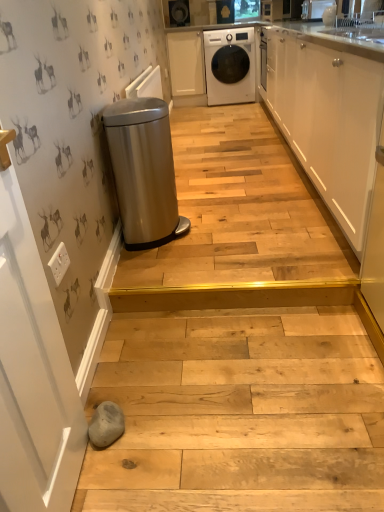
Describe the element at coordinates (230, 66) in the screenshot. I see `white glossy washing machine at upper center` at that location.

This screenshot has height=512, width=384. What do you see at coordinates (186, 63) in the screenshot?
I see `white matte cabinet at center, which appears as the 2th cabinetry when viewed from the right` at bounding box center [186, 63].

Locate an element on the screen. white glossy cabinet at upper right, arranged as the second cabinetry when viewed from the top is located at coordinates (326, 118).

Does stainless steel trash can at left appear on the right side of white glossy washing machine at upper center?

No, stainless steel trash can at left is not to the right of white glossy washing machine at upper center.

Who is taller, stainless steel trash can at left or white glossy washing machine at upper center?

Standing taller between the two is white glossy washing machine at upper center.

Considering the sizes of stainless steel trash can at left and white glossy washing machine at upper center in the image, is stainless steel trash can at left wider or thinner than white glossy washing machine at upper center?

Clearly, stainless steel trash can at left has less width compared to white glossy washing machine at upper center.

From a real-world perspective, is stainless steel trash can at left under white glossy washing machine at upper center?

Correct, in the physical world, stainless steel trash can at left is lower than white glossy washing machine at upper center.

Between white matte cabinet at center, which appears as the 2th cabinetry when viewed from the right, and white glossy cabinet at upper right, which is the first cabinetry from right to left, which one has more height?

white matte cabinet at center, which appears as the 2th cabinetry when viewed from the right, is taller.

Which of these two, white matte cabinet at center, which appears as the 2th cabinetry when viewed from the right, or white glossy cabinet at upper right, which is the 2th cabinetry in left-to-right order, is wider?

white glossy cabinet at upper right, which is the 2th cabinetry in left-to-right order, is wider.

Is white matte cabinet at center, the first cabinetry when ordered from back to front, touching white glossy cabinet at upper right, acting as the 2th cabinetry starting from the back?

There is a gap between white matte cabinet at center, the first cabinetry when ordered from back to front, and white glossy cabinet at upper right, acting as the 2th cabinetry starting from the back.

Looking at this image, which object is positioned more to the left, stainless steel trash can at left or white matte cabinet at center, the 2th cabinetry from the front?

stainless steel trash can at left.

Between stainless steel trash can at left and white matte cabinet at center, which appears as the 2th cabinetry when viewed from the right, which one has less height?

stainless steel trash can at left.

From the image's perspective, would you say stainless steel trash can at left is shown under white matte cabinet at center, the first cabinetry when ordered from back to front?

Indeed, from the image's perspective, stainless steel trash can at left is shown beneath white matte cabinet at center, the first cabinetry when ordered from back to front.

Is white glossy washing machine at upper center oriented towards white glossy cabinet at upper right, which is the first cabinetry from right to left?

Yes, white glossy washing machine at upper center is oriented towards white glossy cabinet at upper right, which is the first cabinetry from right to left.

Can you confirm if white glossy washing machine at upper center is positioned to the right of white glossy cabinet at upper right, arranged as the second cabinetry when viewed from the top?

No, white glossy washing machine at upper center is not to the right of white glossy cabinet at upper right, arranged as the second cabinetry when viewed from the top.

From the image's perspective, is white glossy washing machine at upper center under white glossy cabinet at upper right, acting as the 2th cabinetry starting from the back?

Incorrect, from the image's perspective, white glossy washing machine at upper center is higher than white glossy cabinet at upper right, acting as the 2th cabinetry starting from the back.

Looking at their sizes, would you say white glossy washing machine at upper center is wider or thinner than white glossy cabinet at upper right, which is the first cabinetry from right to left?

Considering their sizes, white glossy washing machine at upper center looks broader than white glossy cabinet at upper right, which is the first cabinetry from right to left.

Is the depth of white glossy cabinet at upper right, which is the first cabinetry from right to left, greater than that of white matte cabinet at center, which appears as the 2th cabinetry when viewed from the right?

No.

Between white glossy cabinet at upper right, acting as the 2th cabinetry starting from the back, and white matte cabinet at center, positioned as the 1th cabinetry in top-to-bottom order, which one has smaller size?

With smaller size is white matte cabinet at center, positioned as the 1th cabinetry in top-to-bottom order.

Measure the distance from white glossy cabinet at upper right, arranged as the second cabinetry when viewed from the top, to white matte cabinet at center, positioned as the first cabinetry in left-to-right order.

white glossy cabinet at upper right, arranged as the second cabinetry when viewed from the top, and white matte cabinet at center, positioned as the first cabinetry in left-to-right order, are 7.39 feet apart from each other.

From the image's perspective, does white glossy cabinet at upper right, which ranks as the first cabinetry in bottom-to-top order, appear higher than white matte cabinet at center, positioned as the first cabinetry in left-to-right order?

No.

From the image's perspective, relative to white glossy washing machine at upper center, is white matte cabinet at center, the second cabinetry positioned from the bottom, above or below?

white matte cabinet at center, the second cabinetry positioned from the bottom, is situated higher than white glossy washing machine at upper center in the image.

Is white matte cabinet at center, the first cabinetry when ordered from back to front, situated inside white glossy washing machine at upper center or outside?

white matte cabinet at center, the first cabinetry when ordered from back to front, is located beyond the bounds of white glossy washing machine at upper center.

Which object is closer to the camera taking this photo, white matte cabinet at center, which appears as the 2th cabinetry when viewed from the right, or white glossy washing machine at upper center?

white glossy washing machine at upper center is more forward.

Can you tell me how much white matte cabinet at center, the first cabinetry when ordered from back to front, and white glossy washing machine at upper center differ in facing direction?

white matte cabinet at center, the first cabinetry when ordered from back to front, and white glossy washing machine at upper center are facing 2.97 degrees away from each other.

From the picture: Does white glossy vase at upper center have a lesser height compared to white glossy washing machine at upper center?

Correct, white glossy vase at upper center is not as tall as white glossy washing machine at upper center.

From the image's perspective, is white glossy vase at upper center above or below white glossy washing machine at upper center?

From the image's perspective, white glossy vase at upper center appears below white glossy washing machine at upper center.

Is white glossy vase at upper center next to white glossy washing machine at upper center?

No, white glossy vase at upper center is not touching white glossy washing machine at upper center.

Considering the sizes of white glossy vase at upper center and white glossy washing machine at upper center in the image, is white glossy vase at upper center bigger or smaller than white glossy washing machine at upper center?

Clearly, white glossy vase at upper center is smaller in size than white glossy washing machine at upper center.

This screenshot has height=512, width=384. I want to click on home appliance on the right side of stainless steel trash can at left, so click(x=230, y=66).

At what (x,y) coordinates should I click in order to perform the action: click on cabinetry in front of the white matte cabinet at center, the second cabinetry positioned from the bottom. Please return your answer as a coordinate pair (x, y). The height and width of the screenshot is (512, 384). Looking at the image, I should click on (326, 118).

Which object lies nearer to the anchor point white glossy washing machine at upper center, stainless steel trash can at left or white matte cabinet at center, the first cabinetry when ordered from back to front?

Among the two, white matte cabinet at center, the first cabinetry when ordered from back to front, is located nearer to white glossy washing machine at upper center.

Estimate the real-world distances between objects in this image. Which object is closer to white glossy washing machine at upper center, white glossy cabinet at upper right, acting as the 2th cabinetry starting from the back, or stainless steel trash can at left?

Based on the image, white glossy cabinet at upper right, acting as the 2th cabinetry starting from the back, appears to be nearer to white glossy washing machine at upper center.

Looking at this image, considering their positions, is white matte cabinet at center, the second cabinetry positioned from the bottom, positioned further to white glossy washing machine at upper center than stainless steel trash can at left?

stainless steel trash can at left is positioned further to the anchor white glossy washing machine at upper center.

Looking at the image, which one is located further to white glossy vase at upper center, white matte cabinet at center, positioned as the 1th cabinetry in top-to-bottom order, or stainless steel trash can at left?

stainless steel trash can at left is further to white glossy vase at upper center.

From the image, which object appears to be farther from stainless steel trash can at left, white glossy cabinet at upper right, which is the first cabinetry from right to left, or white glossy vase at upper center?

white glossy vase at upper center lies further to stainless steel trash can at left than the other object.

Considering their positions, is white glossy washing machine at upper center positioned closer to stainless steel trash can at left than white glossy vase at upper center?

white glossy vase at upper center is positioned closer to the anchor stainless steel trash can at left.

Considering their positions, is white matte cabinet at center, positioned as the first cabinetry in left-to-right order, positioned further to white glossy vase at upper center than white glossy washing machine at upper center?

white matte cabinet at center, positioned as the first cabinetry in left-to-right order, is further to white glossy vase at upper center.

Estimate the real-world distances between objects in this image. Which object is closer to white matte cabinet at center, the first cabinetry when ordered from back to front, white glossy washing machine at upper center or stainless steel trash can at left?

white glossy washing machine at upper center is positioned closer to the anchor white matte cabinet at center, the first cabinetry when ordered from back to front.

The height and width of the screenshot is (512, 384). Find the location of `appliance positioned between white glossy cabinet at upper right, arranged as the second cabinetry when viewed from the top, and white matte cabinet at center, positioned as the 1th cabinetry in top-to-bottom order, from near to far`. appliance positioned between white glossy cabinet at upper right, arranged as the second cabinetry when viewed from the top, and white matte cabinet at center, positioned as the 1th cabinetry in top-to-bottom order, from near to far is located at coordinates (315, 9).

Where is `waste container positioned between white glossy cabinet at upper right, which is the first cabinetry from right to left, and white glossy vase at upper center from near to far`? The width and height of the screenshot is (384, 512). waste container positioned between white glossy cabinet at upper right, which is the first cabinetry from right to left, and white glossy vase at upper center from near to far is located at coordinates (144, 172).

Where is `home appliance between white glossy cabinet at upper right, the first cabinetry positioned from the front, and white matte cabinet at center, the second cabinetry positioned from the bottom, from front to back`? Image resolution: width=384 pixels, height=512 pixels. home appliance between white glossy cabinet at upper right, the first cabinetry positioned from the front, and white matte cabinet at center, the second cabinetry positioned from the bottom, from front to back is located at coordinates (230, 66).

This screenshot has height=512, width=384. I want to click on waste container positioned between white glossy cabinet at upper right, arranged as the second cabinetry when viewed from the top, and white glossy washing machine at upper center from near to far, so click(x=144, y=172).